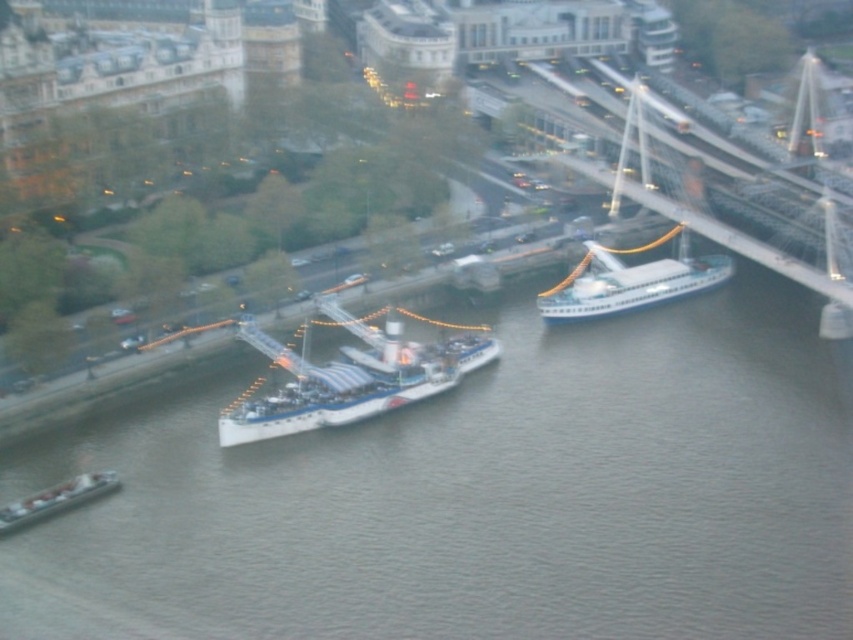
Is point (445, 349) positioned before point (648, 301)?

Yes, it is in front of point (648, 301).

Who is more forward, (254, 422) or (619, 305)?

Positioned in front is point (254, 422).

The image size is (853, 640). Find the location of `white glossy ship at center`. white glossy ship at center is located at coordinates point(349,378).

Can you confirm if gray water at center is positioned to the left of white glossy ship at center?

No, gray water at center is not to the left of white glossy ship at center.

Which is more to the right, gray water at center or white glossy ship at center?

From the viewer's perspective, gray water at center appears more on the right side.

Find the location of `gray water at center`. gray water at center is located at coordinates (477, 493).

Image resolution: width=853 pixels, height=640 pixels. In order to click on gray water at center in this screenshot , I will do `click(477, 493)`.

Does point (561, 301) come in front of point (102, 492)?

No.

Can you confirm if white glossy ship at right is shorter than metallic gray barge at lower left?

In fact, white glossy ship at right may be taller than metallic gray barge at lower left.

Does point (665, 292) come closer to viewer compared to point (94, 472)?

No, (665, 292) is behind (94, 472).

Where is `white glossy ship at right`? This screenshot has height=640, width=853. white glossy ship at right is located at coordinates point(631,282).